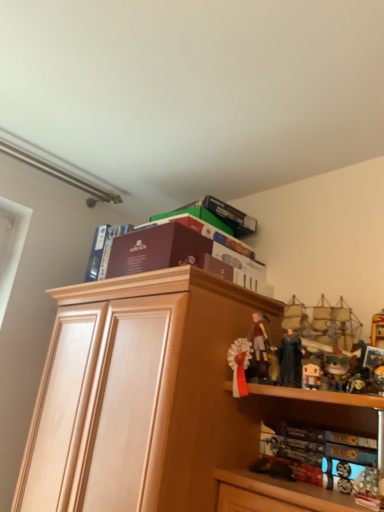
Find the location of `empty space that is ontop of hardcover book at lower right, the fourth book positioned from the top`. empty space that is ontop of hardcover book at lower right, the fourth book positioned from the top is located at coordinates (337, 426).